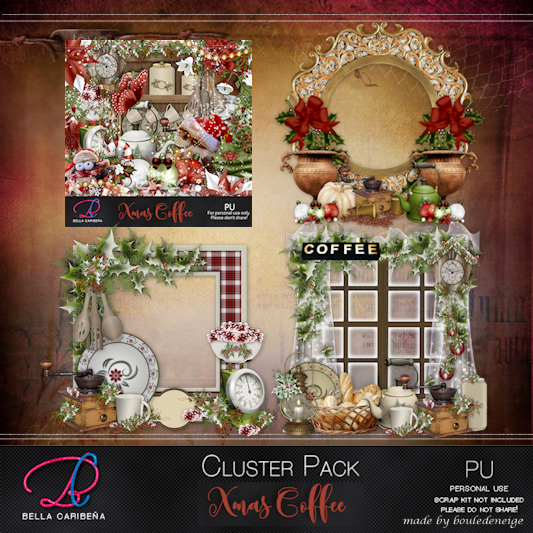
Locate an element on the screen. Image resolution: width=533 pixels, height=533 pixels. white candy bowl is located at coordinates (217, 347).